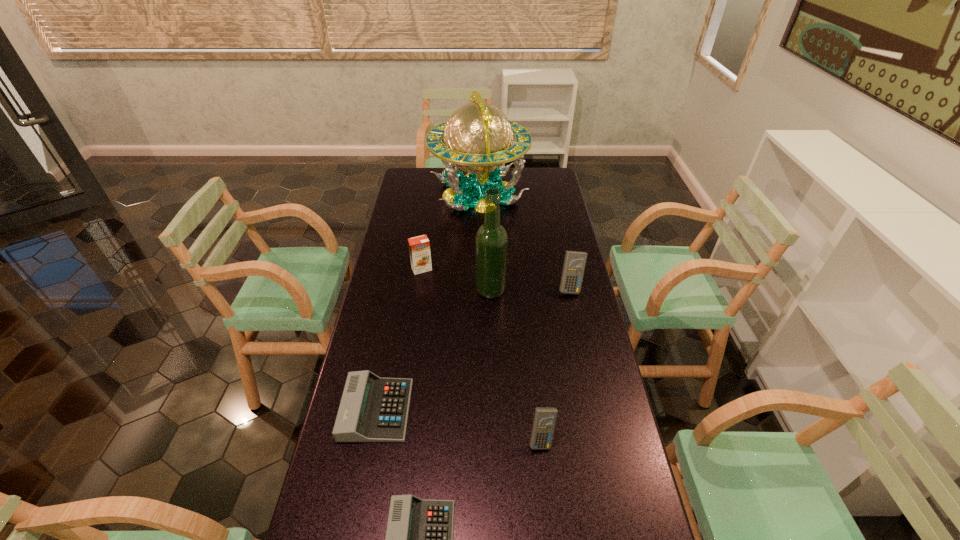
Find the location of a particular element. The width and height of the screenshot is (960, 540). globe that is positioned at the right edge is located at coordinates (478, 137).

Find the location of a particular element. This screenshot has width=960, height=540. calculator present at the right edge is located at coordinates (574, 264).

What are the coordinates of `object that is at the far left corner` in the screenshot? It's located at (478, 137).

Where is `object at the far right corner`? object at the far right corner is located at coordinates (478, 137).

Find the location of `free spot at the left edge of the desktop`. free spot at the left edge of the desktop is located at coordinates coord(401,276).

Image resolution: width=960 pixels, height=540 pixels. I want to click on free region at the right edge of the desktop, so click(x=630, y=475).

Where is `free spot at the far left corner of the desktop`? This screenshot has height=540, width=960. free spot at the far left corner of the desktop is located at coordinates (402, 186).

In the image, there is a desktop. At what (x,y) coordinates should I click in order to perform the action: click on vacant region at the far right corner. Please return your answer as a coordinate pair (x, y). This screenshot has height=540, width=960. Looking at the image, I should click on (557, 174).

I want to click on free space between the liquor and the nearer blue calculator, so click(x=516, y=364).

The width and height of the screenshot is (960, 540). What are the coordinates of `vacant space that is in between the green liquor and the farther gray calculator` in the screenshot? It's located at (434, 350).